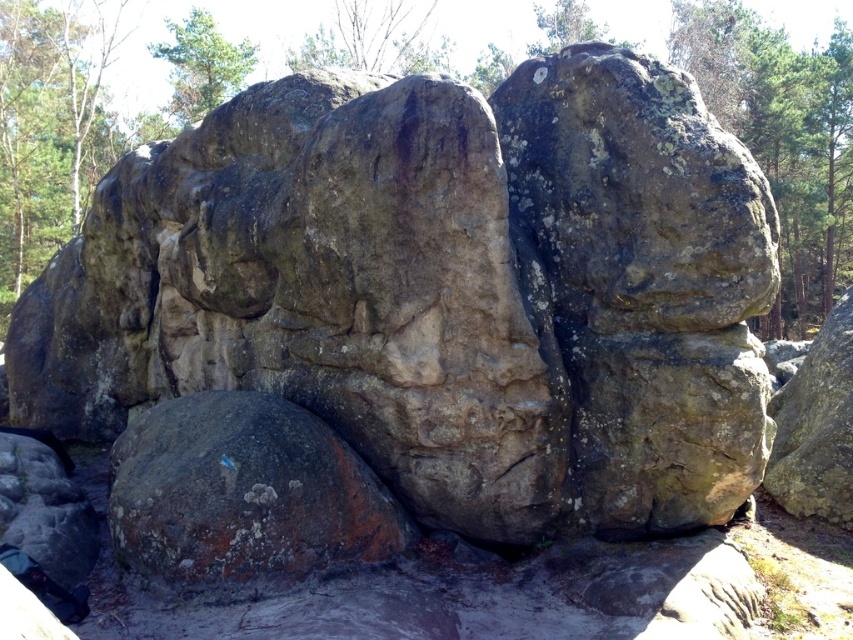
You are a hiker who wants to place a 15 meter long tent between the brown rough rock at center and the green leafy tree at upper left. Can you fit the tent between them without it overlapping either object?

The distance between the brown rough rock at center and the green leafy tree at upper left is 15.06 meters. Since the tent is 15 meters long, it can fit between them with a small gap of 0.06 meters remaining.

You are a hiker trying to navigate through the forest and need to cross a path blocked by two rocks. The rocks are labeled as brown rough rock at center and brown rough rock at right. Which rock is blocking the path more from above?

The brown rough rock at right is blocking the path more from above because the brown rough rock at center is positioned under it.